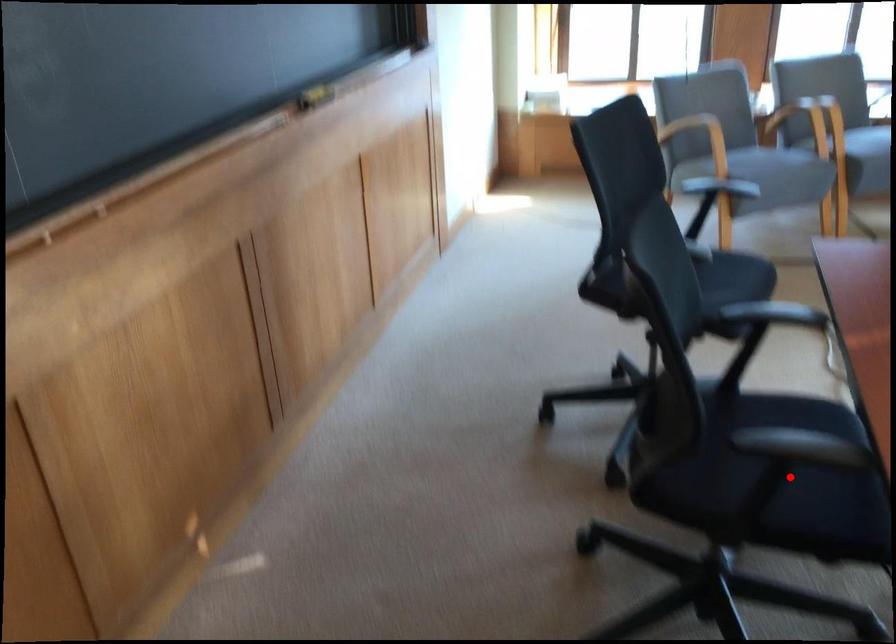
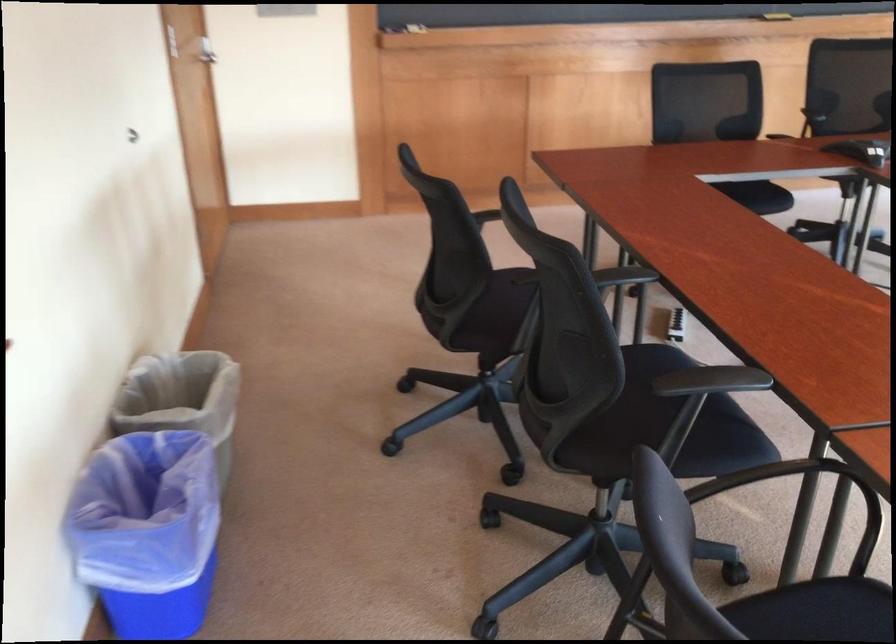
Question: I am providing you with two images of the same scene from different viewpoints. A red point is marked on the first image. At the location where the point appears in image 1, is it still visible in image 2?

Choices:
 (A) Yes
 (B) No

Answer: (B)